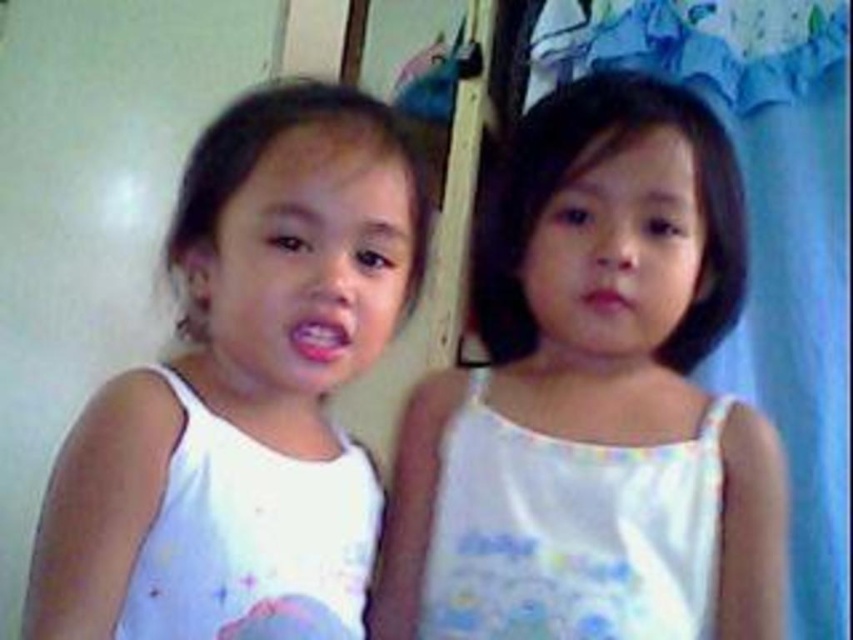
Based on the photo, you are a photographer adjusting the camera focus. You need to ensure both the white cotton tank top at left and the pink glossy lips at center are in focus. Which object should you focus on first to ensure the smaller one is sharp?

The pink glossy lips at center are smaller than the white cotton tank top at left, so you should focus on the pink glossy lips at center first to ensure the smaller detail is sharp.

You are a photographer adjusting the camera focus. The two children are standing in front of you. You need to focus on the white cotton tank top at left and the pink glossy lips at center. Which one is lower in the frame?

The white cotton tank top at left is located below the pink glossy lips at center, so it is lower in the frame.